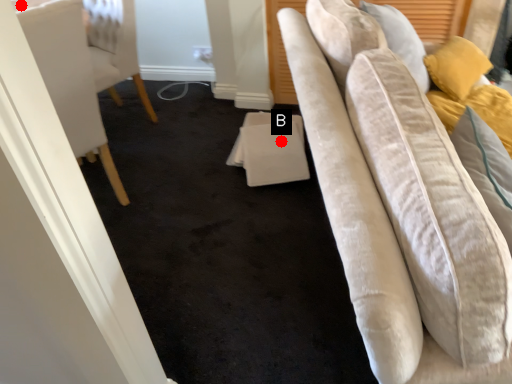
Question: Two points are circled on the image, labeled by A and B beside each circle. Which point is farther from the camera taking this photo?

Choices:
 (A) A is further
 (B) B is further

Answer: (B)